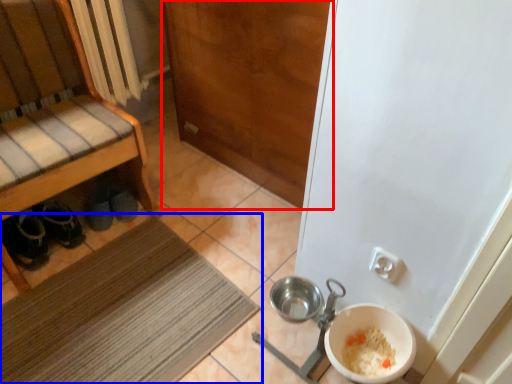
Question: Which object appears farthest to the camera in this image, door (highlighted by a red box) or mat (highlighted by a blue box)?

Choices:
 (A) door
 (B) mat

Answer: (A)